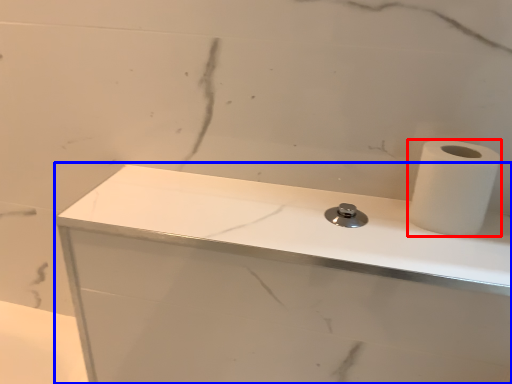
Question: Which point is closer to the camera, paper towel (highlighted by a red box) or counter top (highlighted by a blue box)?

Choices:
 (A) paper towel
 (B) counter top

Answer: (B)